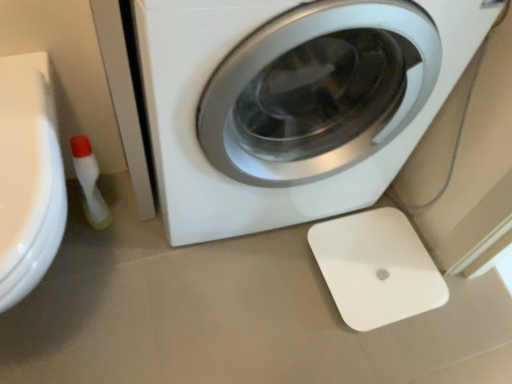
Where is `vacant space in between white glossy washing machine at center and white plastic scale at lower right`? vacant space in between white glossy washing machine at center and white plastic scale at lower right is located at coordinates (281, 281).